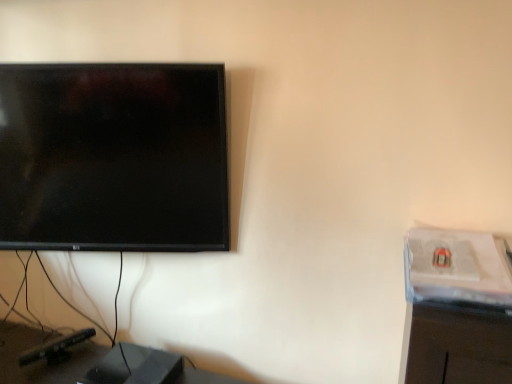
Question: From a real-world perspective, is clear plastic computer desk at right physically located above or below black plastic speaker at lower left?

Choices:
 (A) above
 (B) below

Answer: (A)

Question: Considering the positions of clear plastic computer desk at right and black plastic speaker at lower left in the image, is clear plastic computer desk at right taller or shorter than black plastic speaker at lower left?

Choices:
 (A) tall
 (B) short

Answer: (B)

Question: From the image's perspective, is clear plastic computer desk at right positioned above or below black plastic speaker at lower left?

Choices:
 (A) below
 (B) above

Answer: (B)

Question: From a real-world perspective, is black plastic speaker at lower left physically located above or below clear plastic computer desk at right?

Choices:
 (A) above
 (B) below

Answer: (B)

Question: Is point (25, 349) closer or farther from the camera than point (432, 354)?

Choices:
 (A) closer
 (B) farther

Answer: (B)

Question: Is black plastic speaker at lower left bigger or smaller than clear plastic computer desk at right?

Choices:
 (A) big
 (B) small

Answer: (A)

Question: In terms of width, does black plastic speaker at lower left look wider or thinner when compared to clear plastic computer desk at right?

Choices:
 (A) thin
 (B) wide

Answer: (B)